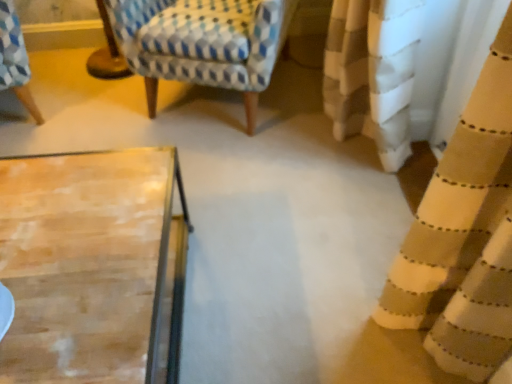
Where is `free region on the left part of patterned fabric rocking chair at upper left`? The height and width of the screenshot is (384, 512). free region on the left part of patterned fabric rocking chair at upper left is located at coordinates (82, 104).